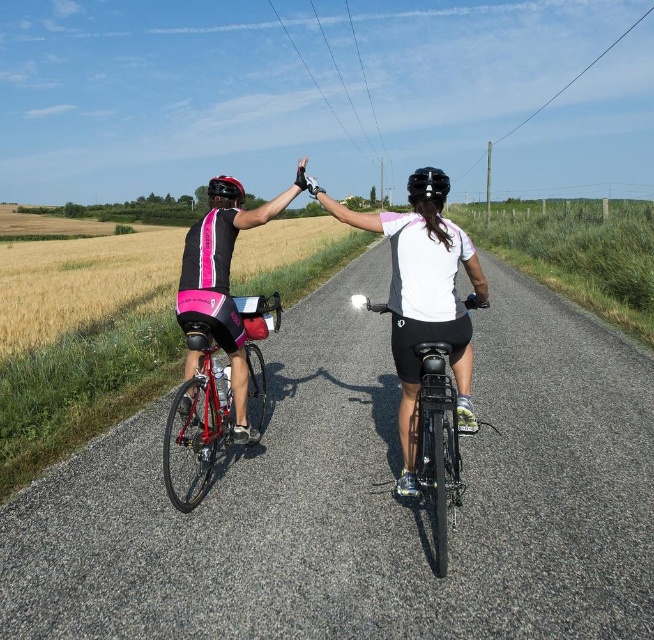
Is shiny red bicycle at left to the right of black matte bicycle at center from the viewer's perspective?

No, shiny red bicycle at left is not to the right of black matte bicycle at center.

Is shiny red bicycle at left closer to camera compared to black matte bicycle at center?

No, shiny red bicycle at left is further to the viewer.

Where is `shiny red bicycle at left`? The image size is (654, 640). shiny red bicycle at left is located at coordinates (198, 422).

Between point (405, 234) and point (443, 195), which one is positioned in front?

Point (405, 234) is more forward.

Between point (428, 214) and point (413, 193), which one is positioned behind?

The point (413, 193) is behind.

I want to click on white matte jersey at center, so click(x=422, y=305).

Find the location of `white matte jersey at center`. white matte jersey at center is located at coordinates (422, 305).

Is point (250, 371) positioned in front of point (419, 192)?

No.

Is point (201, 323) farther from camera compared to point (441, 170)?

No, it is in front of (441, 170).

Who is more forward, (213, 420) or (438, 193)?

Point (438, 193) is in front.

Find the location of a particular element. Image resolution: width=654 pixels, height=640 pixels. shiny red bicycle at left is located at coordinates (198, 422).